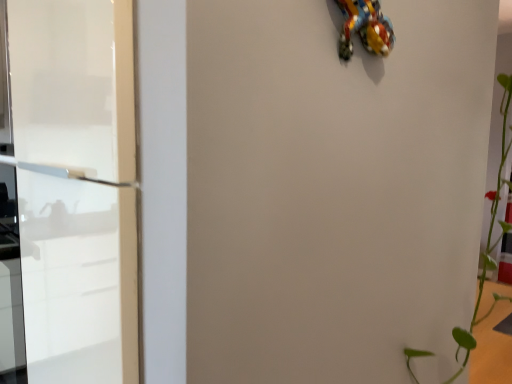
What do you see at coordinates (333, 190) in the screenshot?
I see `white glossy door at upper center` at bounding box center [333, 190].

Locate an element on the screen. white glossy door at upper center is located at coordinates click(333, 190).

The width and height of the screenshot is (512, 384). I want to click on white glossy door at upper center, so click(x=333, y=190).